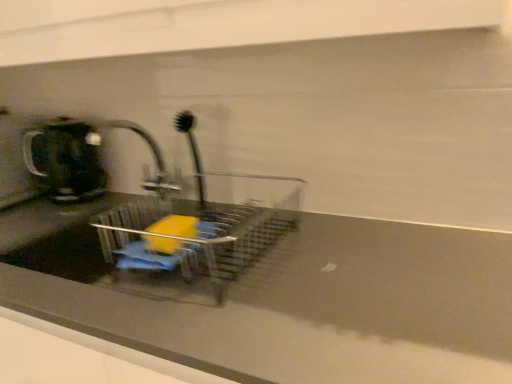
Question: Is the surface of matte black coffeepot at left in direct contact with brushed metal tap at center?

Choices:
 (A) no
 (B) yes

Answer: (A)

Question: Is matte black coffeepot at left closer to camera compared to brushed metal tap at center?

Choices:
 (A) yes
 (B) no

Answer: (B)

Question: Can you confirm if matte black coffeepot at left is wider than brushed metal tap at center?

Choices:
 (A) no
 (B) yes

Answer: (A)

Question: Considering the relative sizes of matte black coffeepot at left and brushed metal tap at center in the image provided, is matte black coffeepot at left thinner than brushed metal tap at center?

Choices:
 (A) yes
 (B) no

Answer: (A)

Question: From a real-world perspective, is matte black coffeepot at left located higher than brushed metal tap at center?

Choices:
 (A) yes
 (B) no

Answer: (A)

Question: Is matte black coffeepot at left bigger or smaller than matte gray counter top at center?

Choices:
 (A) big
 (B) small

Answer: (B)

Question: Would you say matte black coffeepot at left is to the left or to the right of matte gray counter top at center in the picture?

Choices:
 (A) left
 (B) right

Answer: (A)

Question: From a real-world perspective, is matte black coffeepot at left above or below matte gray counter top at center?

Choices:
 (A) below
 (B) above

Answer: (B)

Question: Is matte black coffeepot at left wider or thinner than matte gray counter top at center?

Choices:
 (A) wide
 (B) thin

Answer: (B)

Question: From their relative heights in the image, would you say black plastic brush at center is taller or shorter than brushed metal tap at center?

Choices:
 (A) tall
 (B) short

Answer: (A)

Question: Is point (186, 137) positioned closer to the camera than point (90, 140)?

Choices:
 (A) farther
 (B) closer

Answer: (B)

Question: Is black plastic brush at center inside or outside of brushed metal tap at center?

Choices:
 (A) inside
 (B) outside

Answer: (B)

Question: In the image, is black plastic brush at center positioned in front of or behind brushed metal tap at center?

Choices:
 (A) front
 (B) behind

Answer: (B)

Question: Is brushed metal tap at center spatially inside black plastic brush at center, or outside of it?

Choices:
 (A) outside
 (B) inside

Answer: (A)

Question: From a real-world perspective, relative to black plastic brush at center, is brushed metal tap at center vertically above or below?

Choices:
 (A) above
 (B) below

Answer: (B)